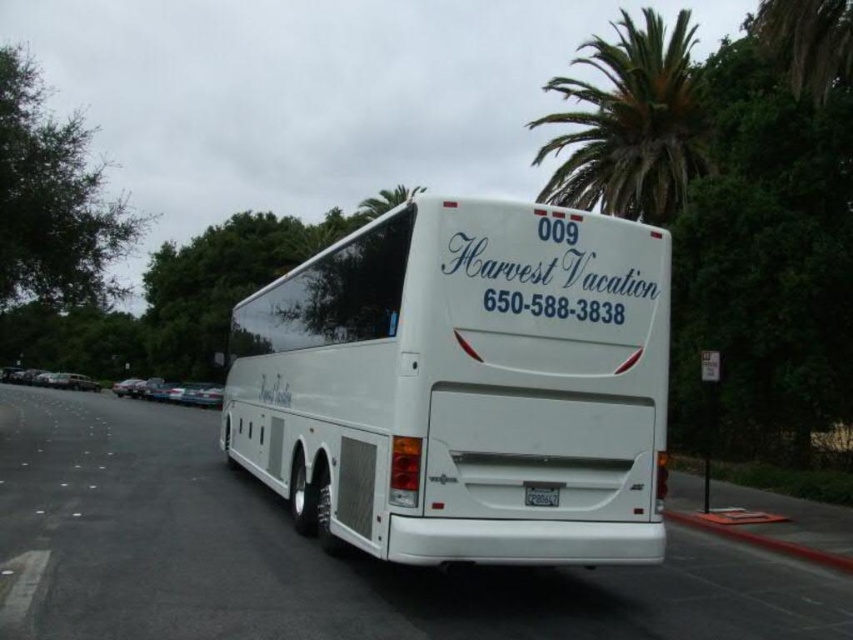
You are standing in a parking lot and see the white glossy bus at center. If you want to approach the bus to take a closer look, how many steps would you need to take to reach it?

The white glossy bus at center is 5.48 meters away from viewer. Assuming an average step length of 0.76 meters, you would need to take approximately 7 steps to reach the bus.

You are a delivery driver who needs to park your truck next to the Harvest Vacation bus. The parking space has a red rubber curb at lower right and a black plastic license plate at center. Which object is bigger in size?

The red rubber curb at lower right is larger in size compared to the black plastic license plate at center according to the description.